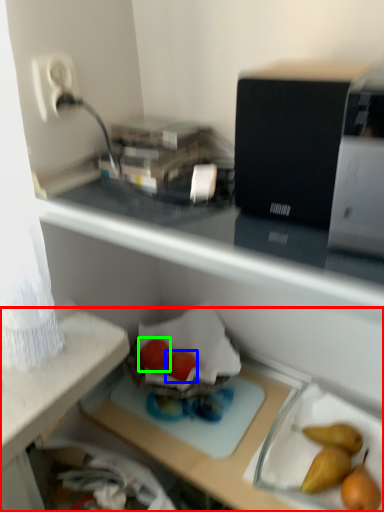
Question: Estimate the real-world distances between objects in this image. Which object is farther from desk (highlighted by a red box), green vegetables (highlighted by a blue box) or green vegetables (highlighted by a green box)?

Choices:
 (A) green vegetables
 (B) green vegetables

Answer: (A)